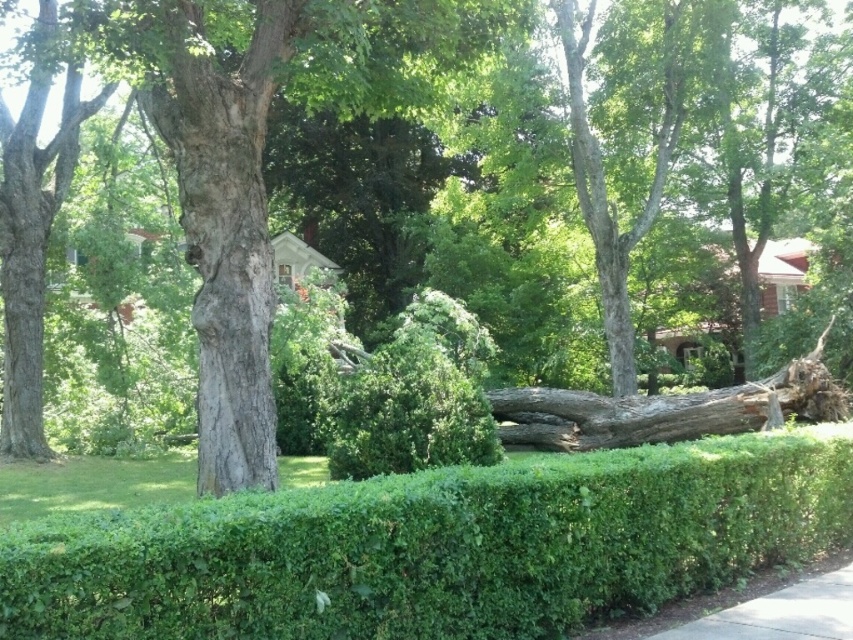
Looking at this image, you are a gardener planning to plant a new flower bed between the green leafy hedge at center and the gray concrete sidewalk at lower right. Based on their positions, which object should you place the flowers closer to to ensure they receive adequate sunlight?

The gray concrete sidewalk at lower right should be placed closer to the flowers because it is located below the green leafy hedge at center, meaning the hedge might cast shade over the sidewalk area. Placing the flowers near the sidewalk would position them under the hedge, potentially providing shade if needed, but since the question asks for adequate sunlight, the flowers should actually be placed closer to the sidewalk where there is less obstruction from the hedge. Wait, but the description says the.

You are standing at the point marked by the coordinates point (437, 547) in the image. What is the nearest object to you?

The point (437, 547) marks the green leafy hedge at center, so the nearest object to you is the green leafy hedge at center.